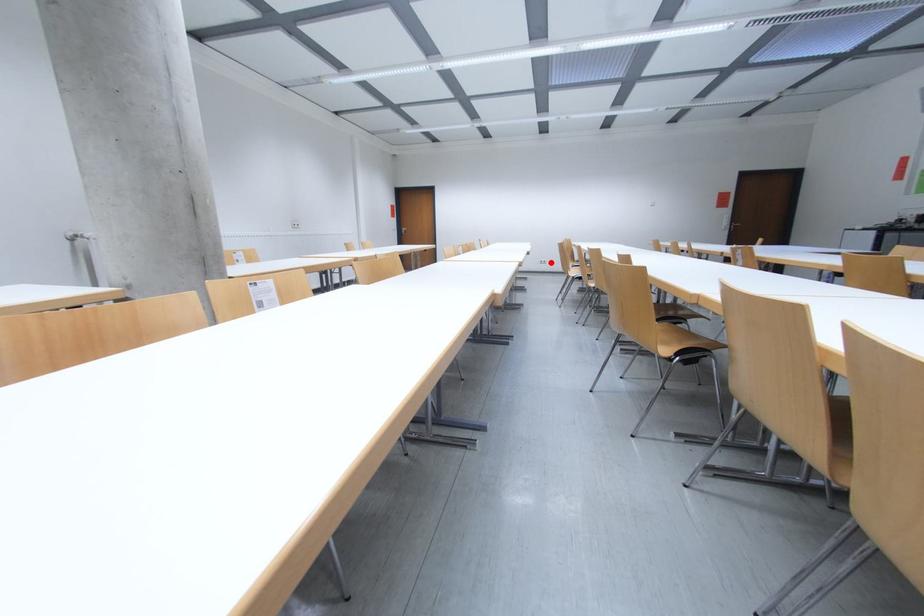
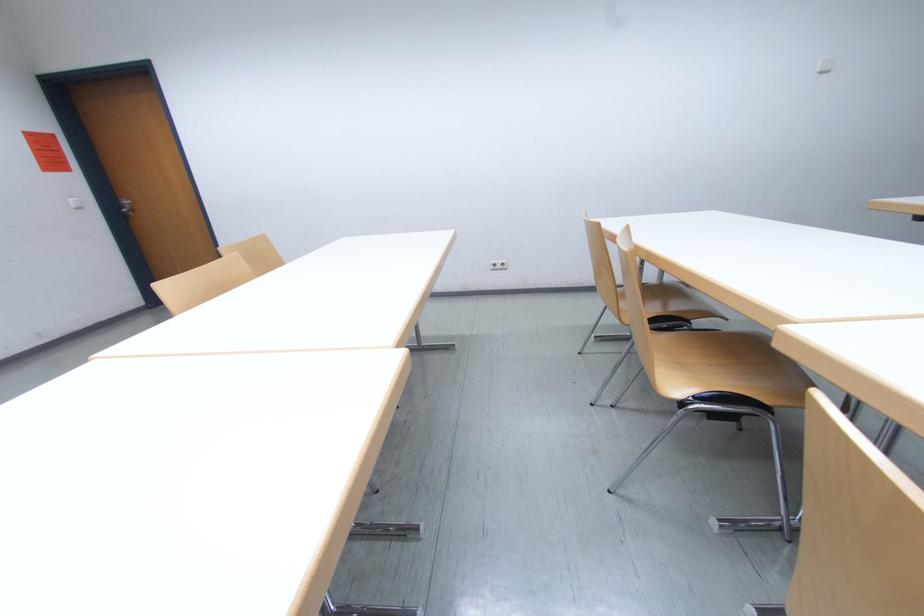
Question: I am providing you with two images of the same scene from different viewpoints. Given a red point in image1, look at the same physical point in image2. Is it:

Choices:
 (A) Closer to the viewpoint
 (B) Farther from the viewpoint

Answer: (B)